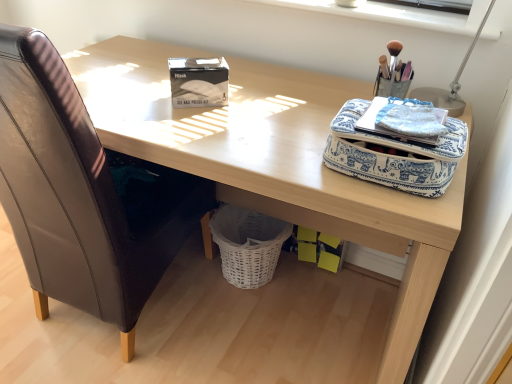
Identify the location of free space to the left of white wicker basket at lower center. The width and height of the screenshot is (512, 384). (189, 276).